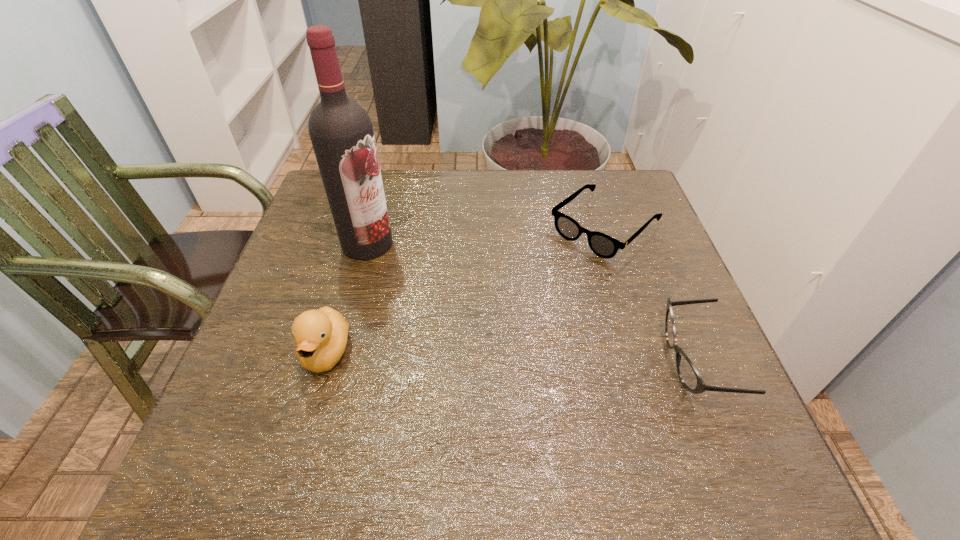
Where is `free space at the far edge`? free space at the far edge is located at coordinates (396, 207).

The width and height of the screenshot is (960, 540). I want to click on vacant space at the near edge of the desktop, so click(443, 385).

I want to click on vacant space at the left edge, so click(343, 290).

This screenshot has height=540, width=960. Find the location of `vacant position at the right edge of the desktop`. vacant position at the right edge of the desktop is located at coordinates (619, 236).

In the image, there is a desktop. What are the coordinates of `blank space at the far right corner` in the screenshot? It's located at (641, 188).

Where is `blank region between the duckling and the tallest object`? blank region between the duckling and the tallest object is located at coordinates (348, 298).

The width and height of the screenshot is (960, 540). Identify the location of empty space between the duckling and the tallest object. (348, 298).

Where is `free point between the duckling and the farther spectacles`? free point between the duckling and the farther spectacles is located at coordinates (466, 290).

The height and width of the screenshot is (540, 960). Identify the location of free area in between the farther spectacles and the wine bottle. (486, 236).

Where is `vacant space that's between the wine bottle and the third shortest object`? The height and width of the screenshot is (540, 960). vacant space that's between the wine bottle and the third shortest object is located at coordinates (348, 298).